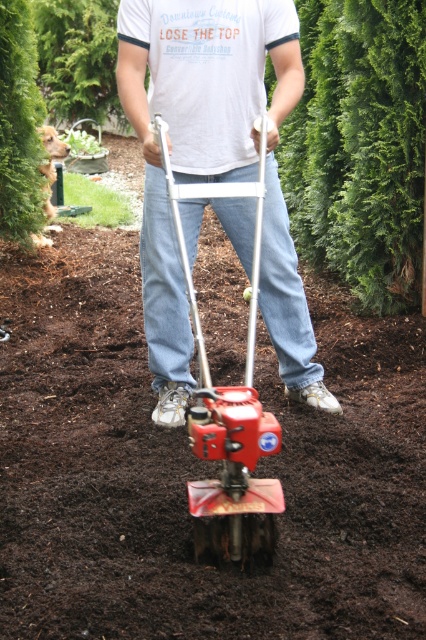
Question: Does metallic red tiller at center have a smaller size compared to green leafy hedge at upper left?

Choices:
 (A) yes
 (B) no

Answer: (B)

Question: Which point appears closest to the camera in this image?

Choices:
 (A) (32, 67)
 (B) (233, 120)
 (C) (187, 273)

Answer: (C)

Question: Does metallic red tiller at center have a smaller size compared to red metallic lawn mower at center?

Choices:
 (A) no
 (B) yes

Answer: (A)

Question: Estimate the real-world distances between objects in this image. Which object is closer to the green leafy hedge at upper left?

Choices:
 (A) red metallic lawn mower at center
 (B) metallic red tiller at center

Answer: (B)

Question: Can you confirm if metallic red tiller at center is positioned to the right of red metallic lawn mower at center?

Choices:
 (A) no
 (B) yes

Answer: (B)

Question: Which point is closer to the camera taking this photo?

Choices:
 (A) (276, 84)
 (B) (238, 460)
 (C) (23, 16)

Answer: (B)